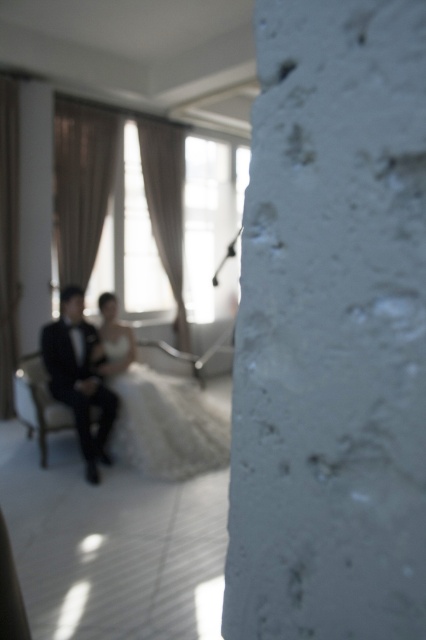
Question: Does white satin dress at center have a greater width compared to black satin suit at left?

Choices:
 (A) yes
 (B) no

Answer: (A)

Question: Among these objects, which one is farthest from the camera?

Choices:
 (A) black satin suit at left
 (B) white satin dress at center

Answer: (B)

Question: Does white satin dress at center come behind black satin suit at left?

Choices:
 (A) no
 (B) yes

Answer: (B)

Question: Is white satin dress at center thinner than black satin suit at left?

Choices:
 (A) no
 (B) yes

Answer: (A)

Question: Which of the following is the closest to the observer?

Choices:
 (A) coord(137,435)
 (B) coord(60,337)

Answer: (A)